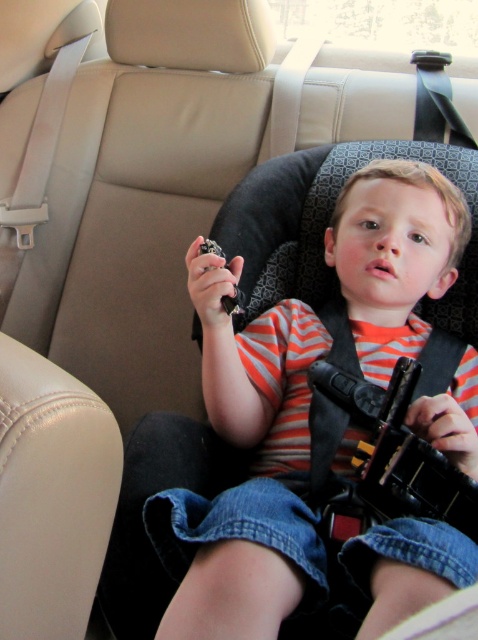
Between point (152, 536) and point (354, 458), which one is positioned behind?

The point (354, 458) is more distant.

Looking at this image, which of these two, striped cotton shirt at center or black plastic toy gun at center, stands taller?

striped cotton shirt at center is taller.

Where is `striped cotton shirt at center`? The width and height of the screenshot is (478, 640). striped cotton shirt at center is located at coordinates (249, 477).